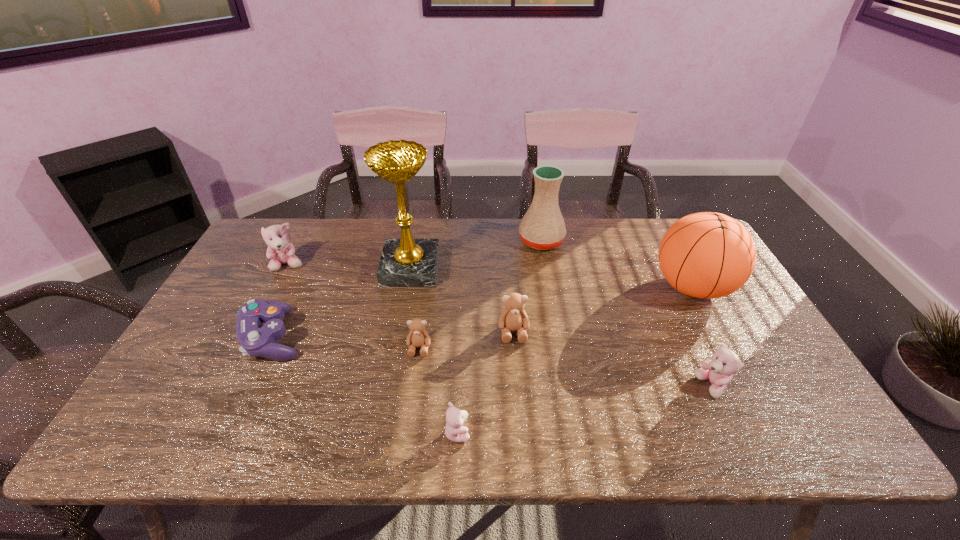
This screenshot has height=540, width=960. I want to click on the fourth closest object to the basketball, so click(x=455, y=431).

Identify which teddy bear is the third closest to the fourth teddy bear from left to right. Please provide its 2D coordinates. Your answer should be formatted as a tuple, i.e. [(x, y)], where the tuple contains the x and y coordinates of a point satisfying the conditions above.

[(719, 370)]

Where is `teddy bear that stands as the second closest to the nearest object`? This screenshot has width=960, height=540. teddy bear that stands as the second closest to the nearest object is located at coordinates (513, 318).

Select which pink teddy bear appears as the closest to the gold award. Please provide its 2D coordinates. Your answer should be formatted as a tuple, i.e. [(x, y)], where the tuple contains the x and y coordinates of a point satisfying the conditions above.

[(280, 251)]

Locate an element on the screen. Image resolution: width=960 pixels, height=540 pixels. the second closest pink teddy bear relative to the control is located at coordinates (455, 431).

Locate an element on the screen. The height and width of the screenshot is (540, 960). free location that satisfies the following two spatial constraints: 1. at the face of the control; 2. on the left side of the farthest pink teddy bear is located at coordinates (252, 337).

At what (x,y) coordinates should I click in order to perform the action: click on vacant position in the image that satisfies the following two spatial constraints: 1. on the front side of the pottery; 2. on the front-facing side of the tallest object. Please return your answer as a coordinate pair (x, y). This screenshot has height=540, width=960. Looking at the image, I should click on [546, 269].